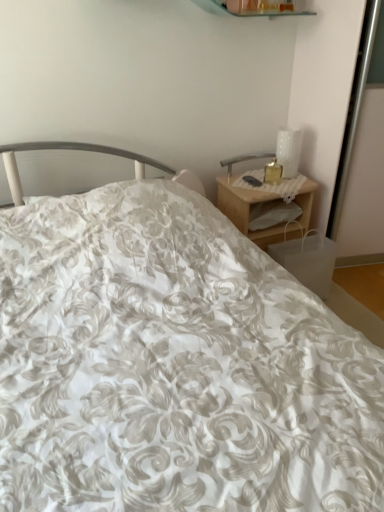
The image size is (384, 512). What do you see at coordinates (288, 150) in the screenshot? I see `white glossy table lamp at upper right` at bounding box center [288, 150].

Where is `white glossy table lamp at upper right`? This screenshot has width=384, height=512. white glossy table lamp at upper right is located at coordinates (288, 150).

Locate an element on the screen. This screenshot has width=384, height=512. woodennightstand at right is located at coordinates (252, 211).

From a real-world perspective, is translucent glass candle at upper right under woodennightstand at right?

No, from a real-world perspective, translucent glass candle at upper right is not below woodennightstand at right.

Is translucent glass candle at upper right inside or outside of woodennightstand at right?

translucent glass candle at upper right cannot be found inside woodennightstand at right.

Which is less distant, (282,172) or (314,193)?

Answer: Clearly, point (282,172) is closer to the camera than point (314,193).

In the scene shown: Between translucent glass candle at upper right and woodennightstand at right, which one is positioned in front?

Positioned in front is woodennightstand at right.

Considering the sizes of objects translucent glass candle at upper right and white glossy table lamp at upper right in the image provided, who is wider, translucent glass candle at upper right or white glossy table lamp at upper right?

Result: With larger width is white glossy table lamp at upper right.

Which object is positioned more to the right, translucent glass candle at upper right or white glossy table lamp at upper right?

white glossy table lamp at upper right.

Is translucent glass candle at upper right taller than white glossy table lamp at upper right?

No, translucent glass candle at upper right is not taller than white glossy table lamp at upper right.

Does translucent glass candle at upper right come behind white glossy table lamp at upper right?

No, translucent glass candle at upper right is in front of white glossy table lamp at upper right.

The height and width of the screenshot is (512, 384). I want to click on candle holder above the woodennightstand at right (from a real-world perspective), so click(x=273, y=172).

Considering the sizes of woodennightstand at right and translucent glass candle at upper right in the image, is woodennightstand at right taller or shorter than translucent glass candle at upper right?

Clearly, woodennightstand at right is taller compared to translucent glass candle at upper right.

What's the angular difference between woodennightstand at right and translucent glass candle at upper right's facing directions?

The angle between the facing direction of woodennightstand at right and the facing direction of translucent glass candle at upper right is 19.6 degrees.

From a real-world perspective, is woodennightstand at right located higher than translucent glass candle at upper right?

Incorrect, from a real-world perspective, woodennightstand at right is lower than translucent glass candle at upper right.

Which object is closer to the camera, woodennightstand at right or white glossy table lamp at upper right?

woodennightstand at right.

Is white glossy table lamp at upper right a part of woodennightstand at right?

No, white glossy table lamp at upper right is not a part of woodennightstand at right.

How different are the orientations of woodennightstand at right and white glossy table lamp at upper right in degrees?

There is a 0.773-degree angle between the facing directions of woodennightstand at right and white glossy table lamp at upper right.

Does white glossy table lamp at upper right have a greater width compared to translucent glass candle at upper right?

Yes.

Between white glossy table lamp at upper right and translucent glass candle at upper right, which one appears on the left side from the viewer's perspective?

translucent glass candle at upper right.

Considering the positions of objects white glossy table lamp at upper right and translucent glass candle at upper right in the image provided, who is behind, white glossy table lamp at upper right or translucent glass candle at upper right?

white glossy table lamp at upper right.

Consider the image. Would you consider white glossy table lamp at upper right to be distant from translucent glass candle at upper right?

No.

Where is `nightstand in front of the white glossy table lamp at upper right`? The height and width of the screenshot is (512, 384). nightstand in front of the white glossy table lamp at upper right is located at coordinates tap(252, 211).

From the picture: Which of these two, white glossy table lamp at upper right or woodennightstand at right, is thinner?

With smaller width is white glossy table lamp at upper right.

From the image's perspective, is white glossy table lamp at upper right beneath woodennightstand at right?

No, from the image's perspective, white glossy table lamp at upper right is not beneath woodennightstand at right.

In order to click on candle holder on the right of the woodennightstand at right in this screenshot , I will do `click(273, 172)`.

Find the location of a particular element. The height and width of the screenshot is (512, 384). candle holder that appears below the white glossy table lamp at upper right (from a real-world perspective) is located at coordinates (273, 172).

Estimate the real-world distances between objects in this image. Which object is closer to translucent glass candle at upper right, white glossy table lamp at upper right or woodennightstand at right?

Among the two, white glossy table lamp at upper right is located nearer to translucent glass candle at upper right.

From the image, which object appears to be nearer to woodennightstand at right, white glossy table lamp at upper right or translucent glass candle at upper right?

translucent glass candle at upper right.

Looking at the image, which one is located closer to translucent glass candle at upper right, woodennightstand at right or white glossy table lamp at upper right?

white glossy table lamp at upper right is closer to translucent glass candle at upper right.

Considering their positions, is translucent glass candle at upper right positioned closer to woodennightstand at right than white glossy table lamp at upper right?

translucent glass candle at upper right.

Considering their positions, is woodennightstand at right positioned further to white glossy table lamp at upper right than translucent glass candle at upper right?

Based on the image, woodennightstand at right appears to be further to white glossy table lamp at upper right.

Based on their spatial positions, is translucent glass candle at upper right or woodennightstand at right closer to white glossy table lamp at upper right?

The object closer to white glossy table lamp at upper right is translucent glass candle at upper right.

Find the location of a particular element. The width and height of the screenshot is (384, 512). candle holder between white glossy table lamp at upper right and woodennightstand at right vertically is located at coordinates (273, 172).